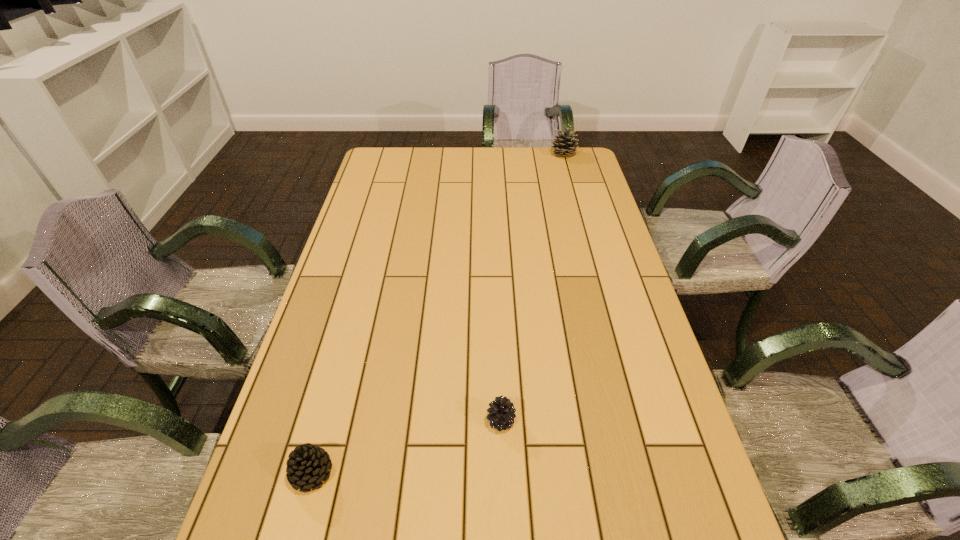
The width and height of the screenshot is (960, 540). Find the location of `free spot that satisfies the following two spatial constraints: 1. on the back side of the second object from right to left; 2. on the left side of the tallest pinecone`. free spot that satisfies the following two spatial constraints: 1. on the back side of the second object from right to left; 2. on the left side of the tallest pinecone is located at coordinates (492, 155).